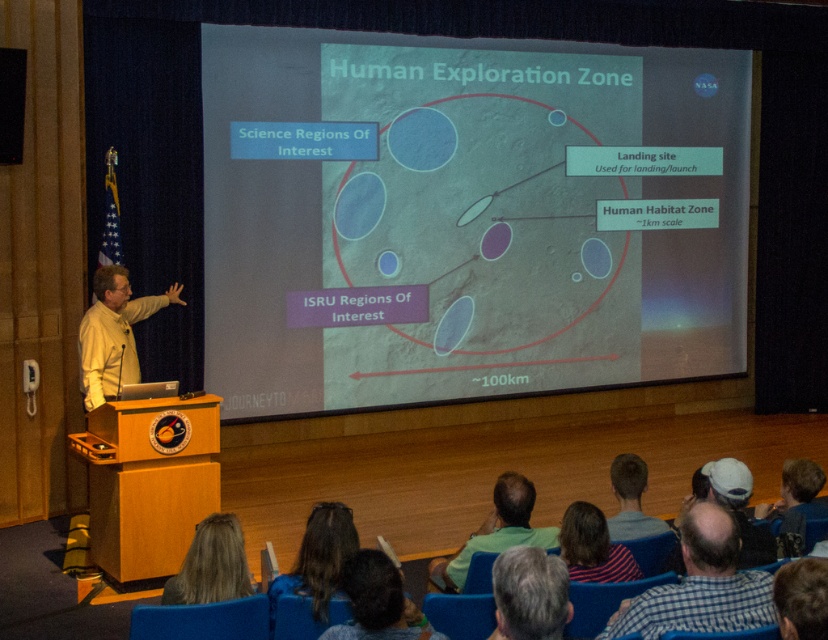
You are an attendee in the audience of this presentation. You notice two shirts on the speaker. The checkered fabric shirt at lower right and the green shirt at lower center. Which shirt is closer to you?

The checkered fabric shirt at lower right is closer to the viewer than the green shirt at lower center.

You are an astronaut preparing for a mission and need to pack a hat that fits under your helmet. Your helmet has an interior width of 20 cm. The white matte cap at lower center is 18 cm wide. Can the gray hair at center, which is narrower than the cap, fit inside the helmet?

The gray hair at center has a width less than the white matte cap at lower center, which is 18 cm. Since the helmet has an interior width of 20 cm, the gray hair at center can fit inside the helmet as it is narrower than both the cap and the helmet.